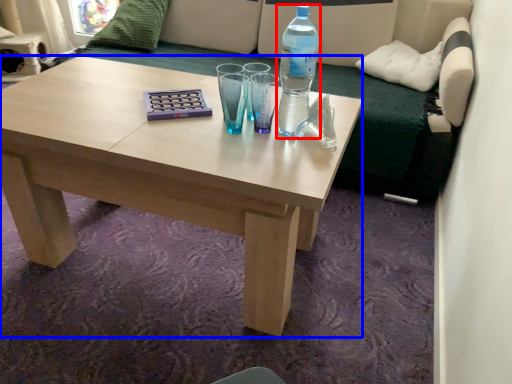
Question: Which point is further to the camera, bottle (highlighted by a red box) or coffee table (highlighted by a blue box)?

Choices:
 (A) bottle
 (B) coffee table

Answer: (A)